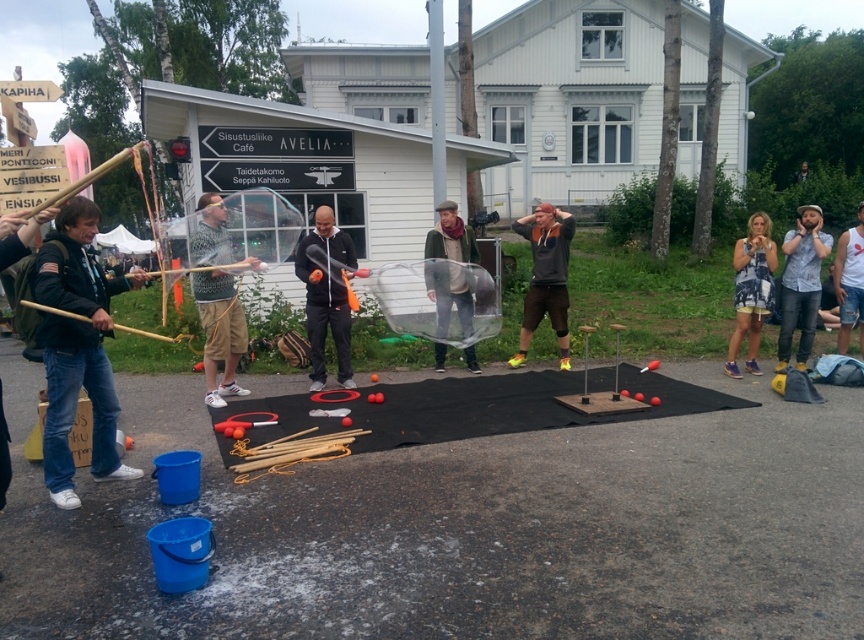
Can you confirm if orange fabric at center is positioned below denim shirt at right?

No.

Who is shorter, orange fabric at center or denim shirt at right?

With less height is orange fabric at center.

Is point (532, 292) less distant than point (804, 346)?

That is False.

Identify the location of orange fabric at center. (545, 276).

Which is in front, point (324, 294) or point (861, 332)?

Point (324, 294) is more forward.

Which is below, black matte jacket at center or white cotton tank top at right?

white cotton tank top at right is below.

I want to click on black matte jacket at center, so click(x=326, y=298).

How far apart are denim jacket at left and black matte jacket at center?

9.08 feet

Can you confirm if denim jacket at left is positioned to the left of black matte jacket at center?

Yes, denim jacket at left is to the left of black matte jacket at center.

The width and height of the screenshot is (864, 640). What do you see at coordinates (77, 348) in the screenshot?
I see `denim jacket at left` at bounding box center [77, 348].

At what (x,y) coordinates should I click in order to perform the action: click on denim jacket at left. Please return your answer as a coordinate pair (x, y). The image size is (864, 640). Looking at the image, I should click on (77, 348).